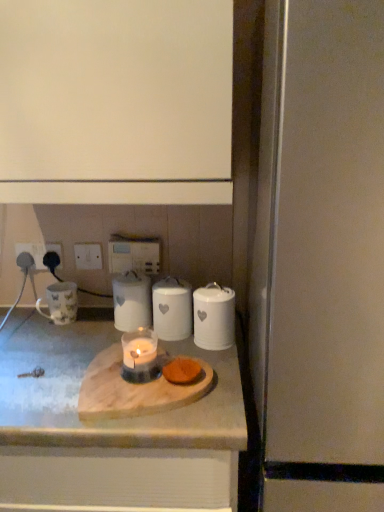
This screenshot has width=384, height=512. Find the location of `vacant space to the left of white glossy mug at left, which appears as the 5th appliance when viewed from the right`. vacant space to the left of white glossy mug at left, which appears as the 5th appliance when viewed from the right is located at coordinates (27, 323).